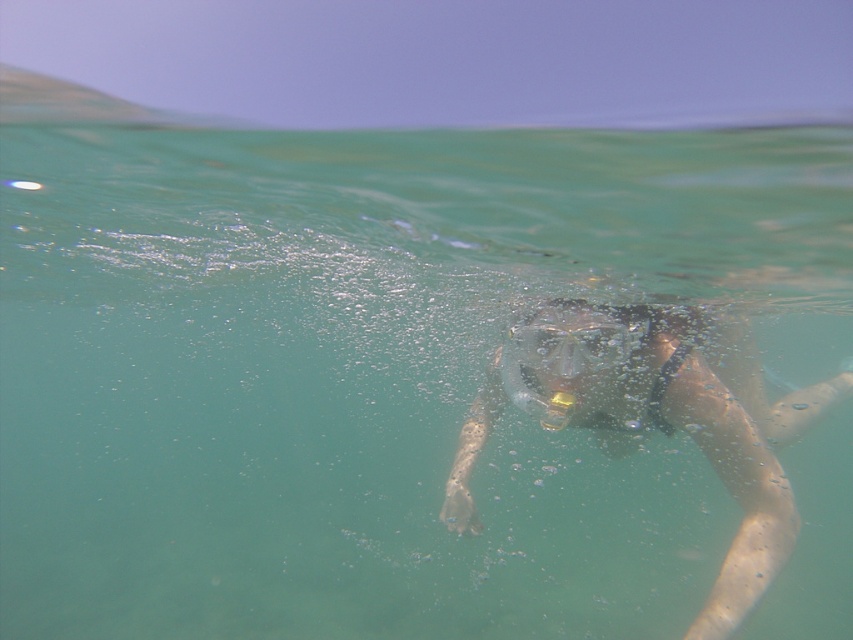
Can you confirm if transparent plastic snorkel mask at center is wider than transparent plastic goggles at center?

Yes, transparent plastic snorkel mask at center is wider than transparent plastic goggles at center.

Does transparent plastic snorkel mask at center appear on the left side of transparent plastic goggles at center?

Incorrect, transparent plastic snorkel mask at center is not on the left side of transparent plastic goggles at center.

Does point (579, 372) lie in front of point (532, 328)?

Yes, point (579, 372) is in front of point (532, 328).

You are a GUI agent. You are given a task and a screenshot of the screen. Output one action in this format:
    pyautogui.click(x=<x>, y=<y>)
    Task: Click on the transparent plastic snorkel mask at center
    
    Given the screenshot: What is the action you would take?
    pyautogui.click(x=657, y=419)